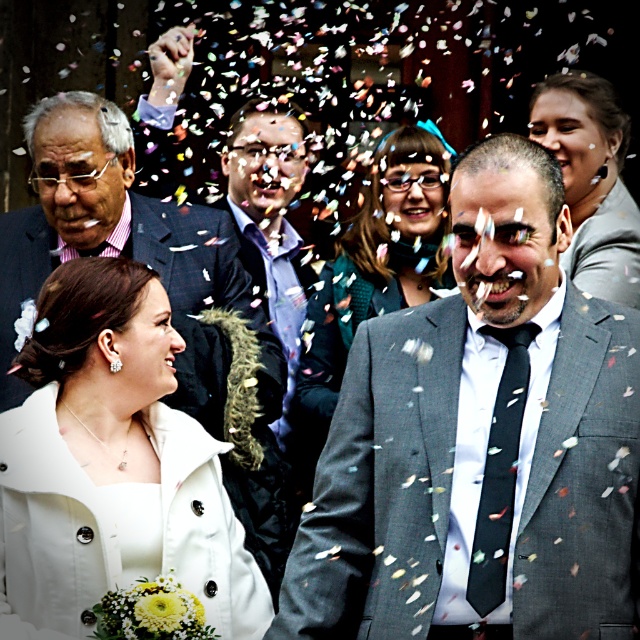
Can you confirm if gray textured suit at center is taller than plaid wool suit at left?

Correct, gray textured suit at center is much taller as plaid wool suit at left.

Which is more to the left, gray textured suit at center or plaid wool suit at left?

plaid wool suit at left

Find the location of `gray textured suit at center`. gray textured suit at center is located at coordinates (481, 442).

Is matte green dress at center taller than matte gray suit at upper right?

Yes.

From the picture: Which is below, matte green dress at center or matte gray suit at upper right?

matte green dress at center

Is point (413, 284) closer to camera compared to point (589, 106)?

No.

The width and height of the screenshot is (640, 640). What are the coordinates of `matte green dress at center` in the screenshot? It's located at (387, 244).

Does white satin dress at lower left have a lesser height compared to plaid wool suit at left?

Yes, white satin dress at lower left is shorter than plaid wool suit at left.

Who is taller, white satin dress at lower left or plaid wool suit at left?

Standing taller between the two is plaid wool suit at left.

Image resolution: width=640 pixels, height=640 pixels. Identify the location of white satin dress at lower left. (113, 464).

The width and height of the screenshot is (640, 640). What are the coordinates of `white satin dress at lower left` in the screenshot? It's located at (113, 464).